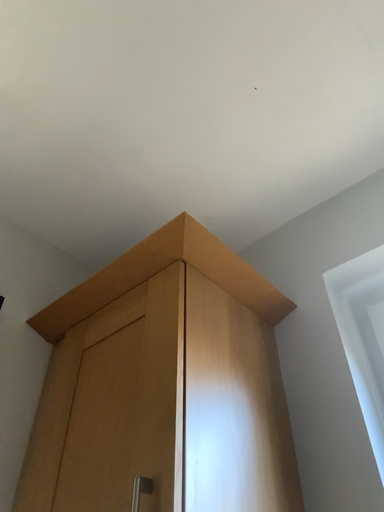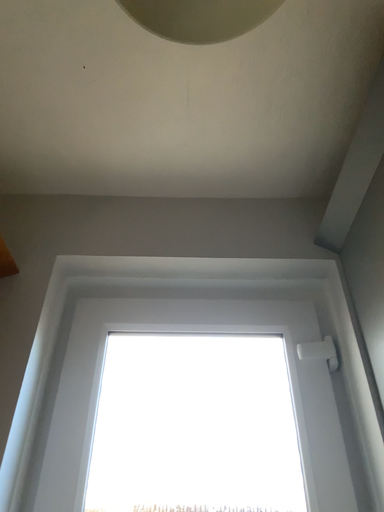
Question: How did the camera likely rotate when shooting the video?

Choices:
 (A) rotated upward
 (B) rotated downward

Answer: (B)